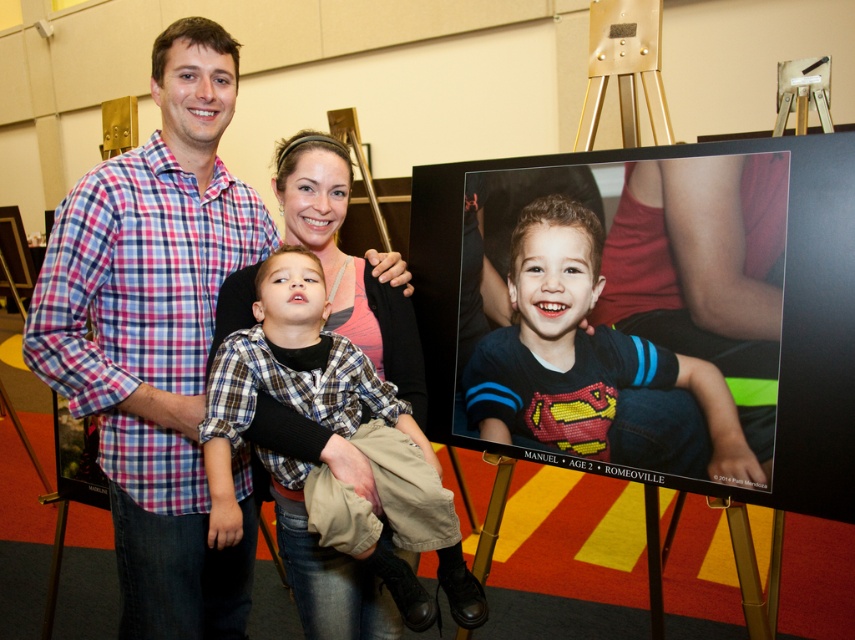
You are a photographer standing 5 feet away from the camera. You need to adjust the focus on the plaid cotton shirt at center. Can you reach it without moving closer?

The plaid cotton shirt at center and camera are 4.67 feet apart. Since you are standing 5 feet away from the camera, you are 0.33 feet away from the plaid cotton shirt at center. You can reach it without moving closer.